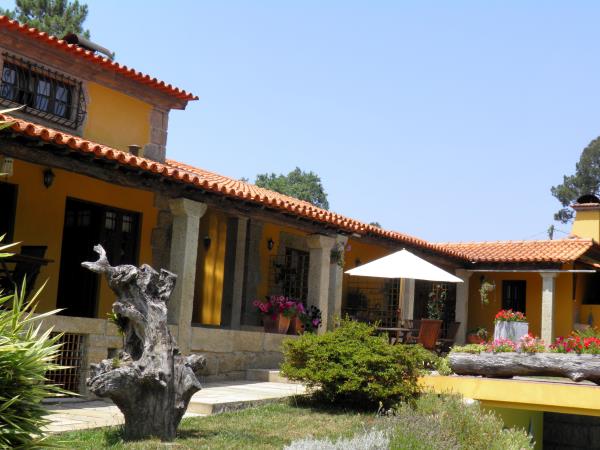
Identify the location of yellow walls. The image size is (600, 450). (117, 115), (41, 221), (530, 287).